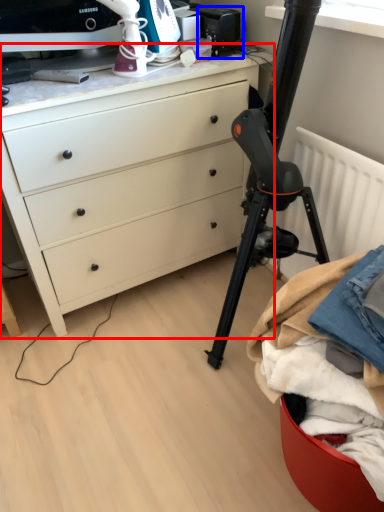
Question: Which of the following is the farthest to the observer, chest of drawers (highlighted by a red box) or appliance (highlighted by a blue box)?

Choices:
 (A) chest of drawers
 (B) appliance

Answer: (B)